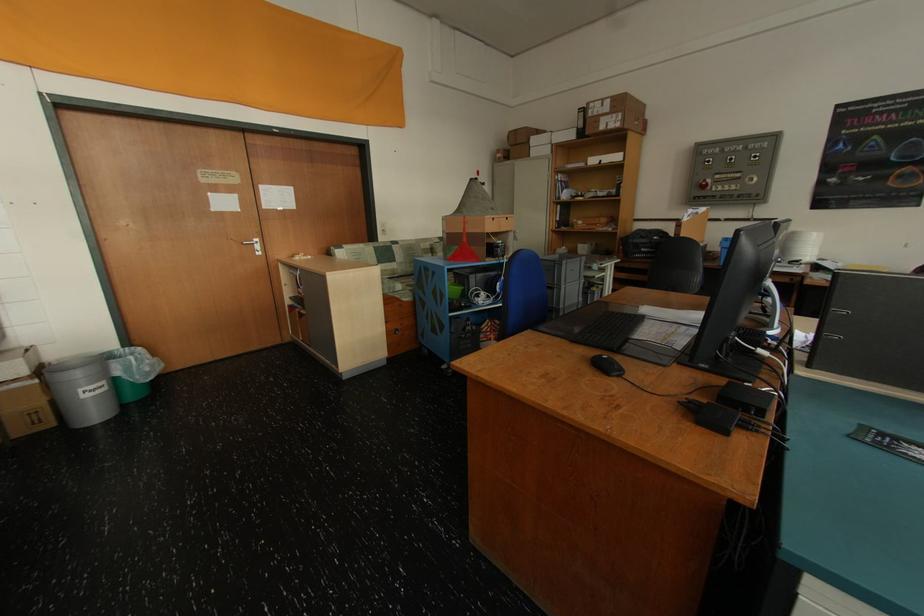
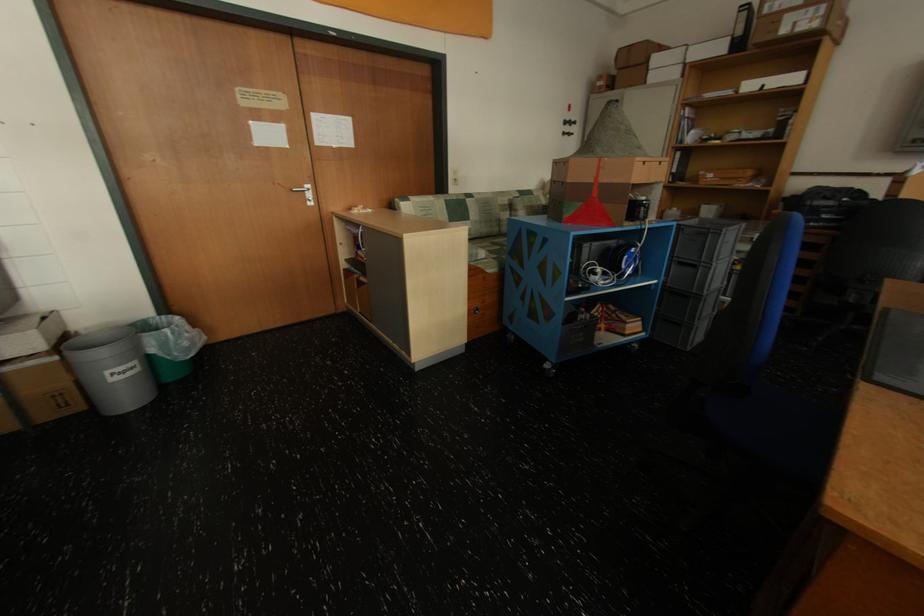
Where in the second image is the point corresponding to [589,224] from the first image?

(719, 177)